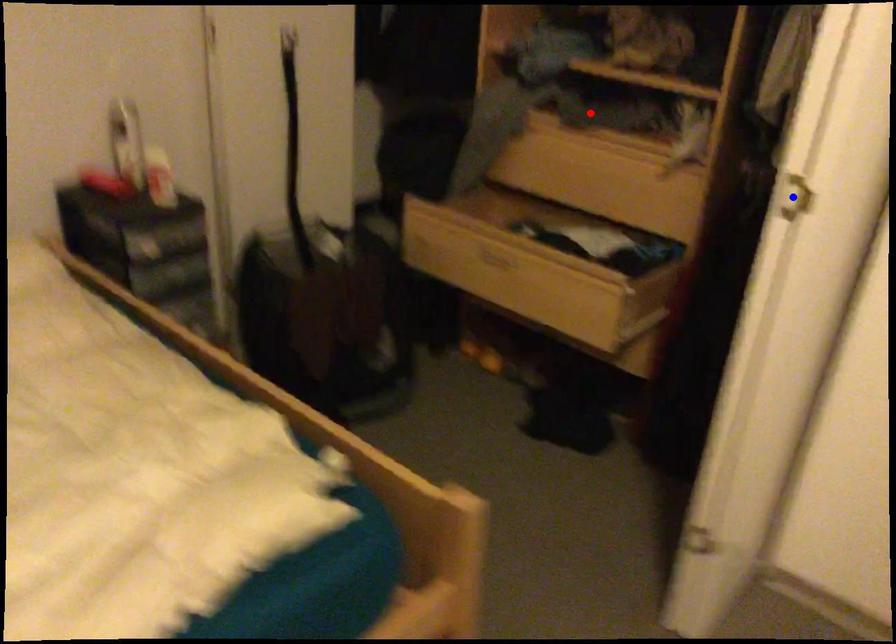
Question: Which of the two points in the image is closer to the camera?

Choices:
 (A) Blue point is closer.
 (B) Red point is closer.

Answer: (A)